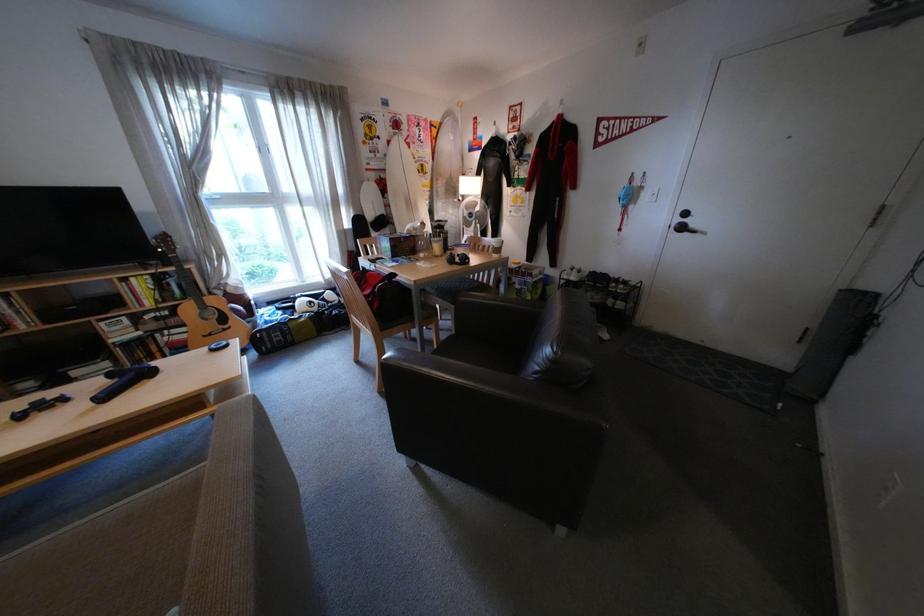
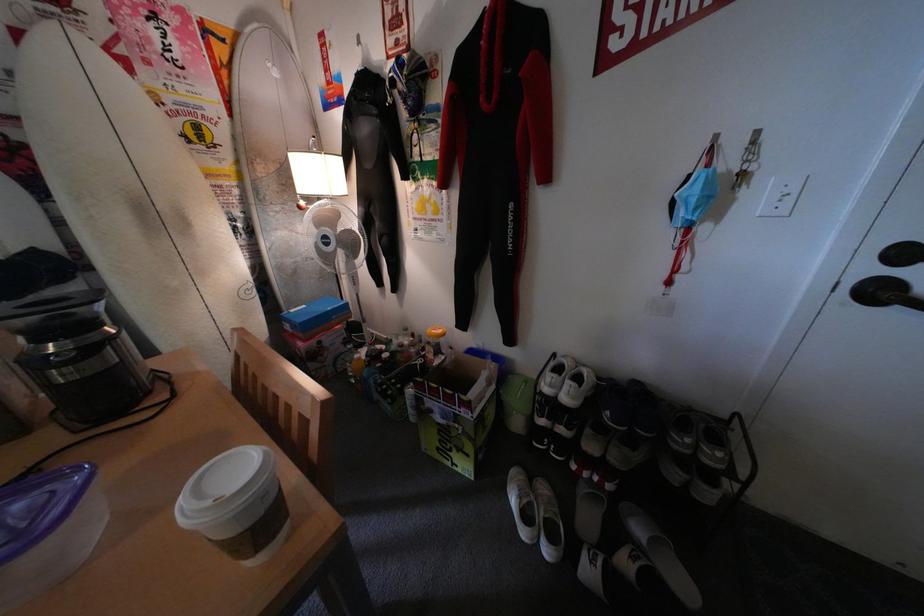
Locate, in the second image, the point that corresponds to point 685,227 in the first image.

(853, 284)